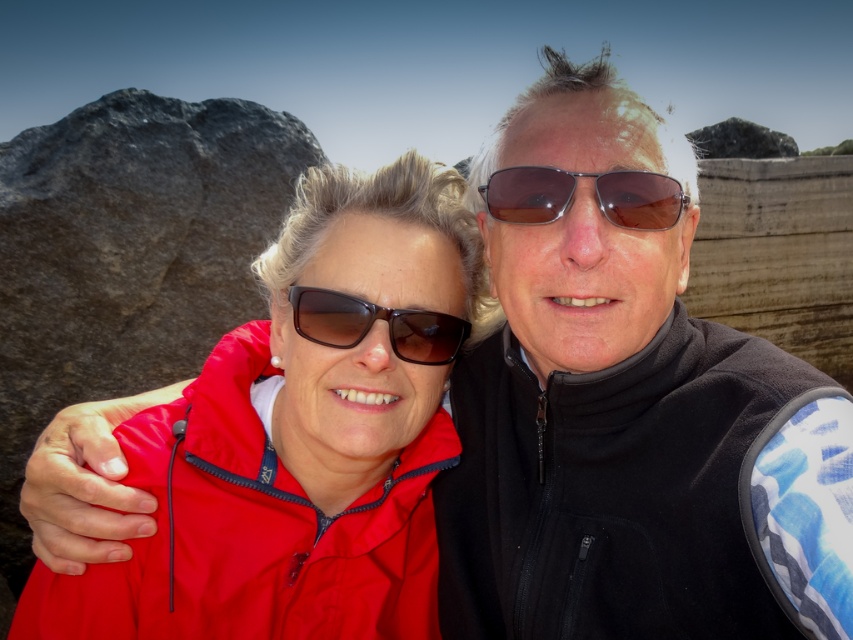
Is black fleece jacket at center taller than matte black sunglasses at center?

Indeed, black fleece jacket at center has a greater height compared to matte black sunglasses at center.

Who is higher up, black fleece jacket at center or matte black sunglasses at center?

matte black sunglasses at center is higher up.

Describe the element at coordinates (628, 406) in the screenshot. I see `black fleece jacket at center` at that location.

Where is `black fleece jacket at center`? Image resolution: width=853 pixels, height=640 pixels. black fleece jacket at center is located at coordinates (628, 406).

Is black fleece jacket at center above matte red jacket at center?

Correct, black fleece jacket at center is located above matte red jacket at center.

Who is taller, black fleece jacket at center or matte red jacket at center?

black fleece jacket at center is taller.

At what (x,y) coordinates should I click in order to perform the action: click on black fleece jacket at center. Please return your answer as a coordinate pair (x, y). Looking at the image, I should click on (628, 406).

Can you confirm if matte red jacket at center is wider than matte black sunglasses at center?

Correct, the width of matte red jacket at center exceeds that of matte black sunglasses at center.

Which is behind, point (88, 579) or point (413, 314)?

Positioned behind is point (413, 314).

Image resolution: width=853 pixels, height=640 pixels. I want to click on matte red jacket at center, so click(x=302, y=435).